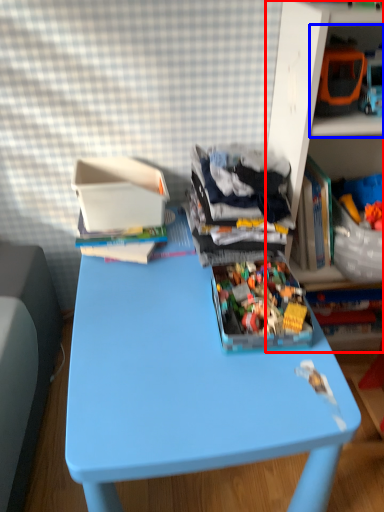
Question: Which of the following is the closest to the observer, shelf (highlighted by a red box) or shelf (highlighted by a blue box)?

Choices:
 (A) shelf
 (B) shelf

Answer: (A)